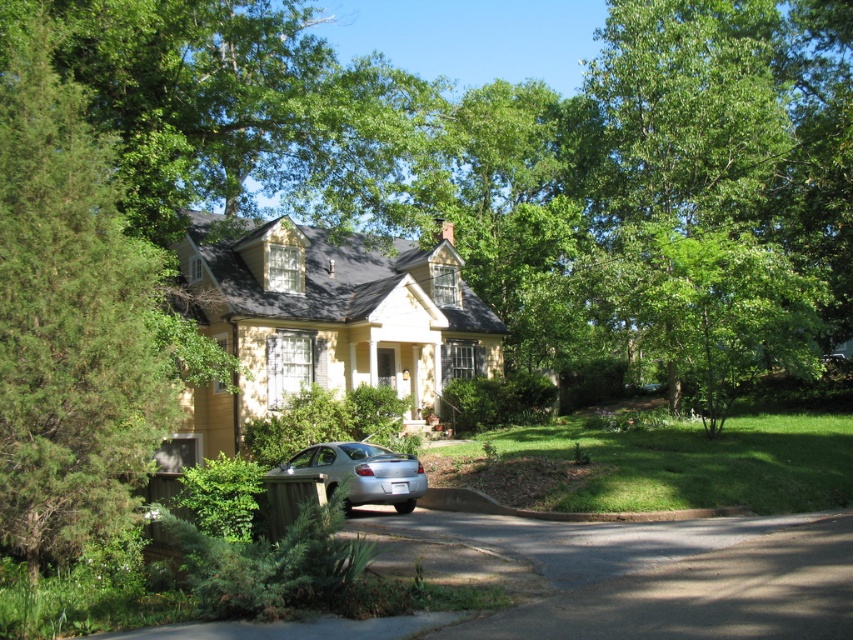
You are a delivery person arriving at this house to drop off a package. You see the black asphalt driveway at lower center and the brown concrete curb at lower center. Which one should you park your vehicle on?

You should park your vehicle on the black asphalt driveway at lower center because it is designed for parking, while the brown concrete curb at lower center is likely a boundary or edge and not meant for parking.

You are a delivery person trying to park your van next to the brown concrete curb at lower center. The van is 2 meters wide. Can you park your van next to the silver metallic sedan at lower left without overlapping them?

The silver metallic sedan at lower left is wider than the brown concrete curb at lower center, so the curb may not be wide enough to accommodate the van which is 2 meters wide. Therefore, parking the van next to the silver metallic sedan at lower left might not be possible without overlapping.

You are a delivery person approaching the house and need to park your vehicle. The driveway is narrow. You see the green textured tree at left and the brown concrete curb at lower center. Which object is closer to the house, indicating where to park?

The green textured tree at left is in front of the brown concrete curb at lower center, meaning the curb is closer to the house. Park near the brown concrete curb at lower center for proper parking.